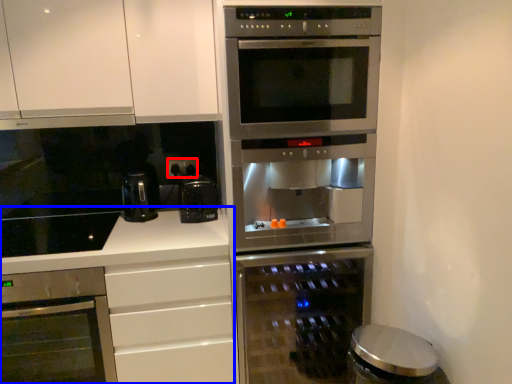
Question: Which of the following is the closest to the observer, electric outlet (highlighted by a red box) or counter (highlighted by a blue box)?

Choices:
 (A) electric outlet
 (B) counter

Answer: (B)